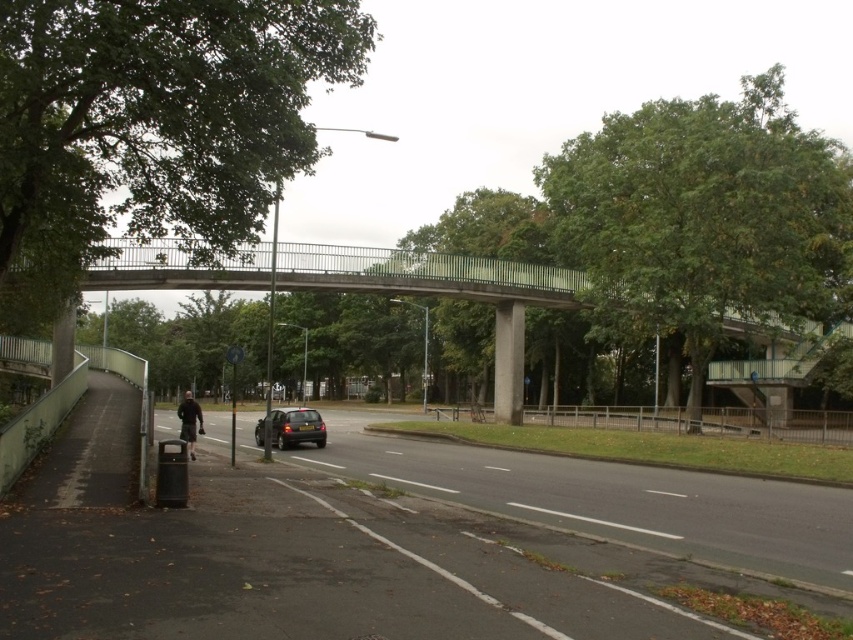
Can you confirm if green metallic bridge at center is positioned above shiny black car at center?

Correct, green metallic bridge at center is located above shiny black car at center.

Identify the location of green metallic bridge at center. The image size is (853, 640). (358, 285).

Where is `green metallic bridge at center`? Image resolution: width=853 pixels, height=640 pixels. green metallic bridge at center is located at coordinates (358, 285).